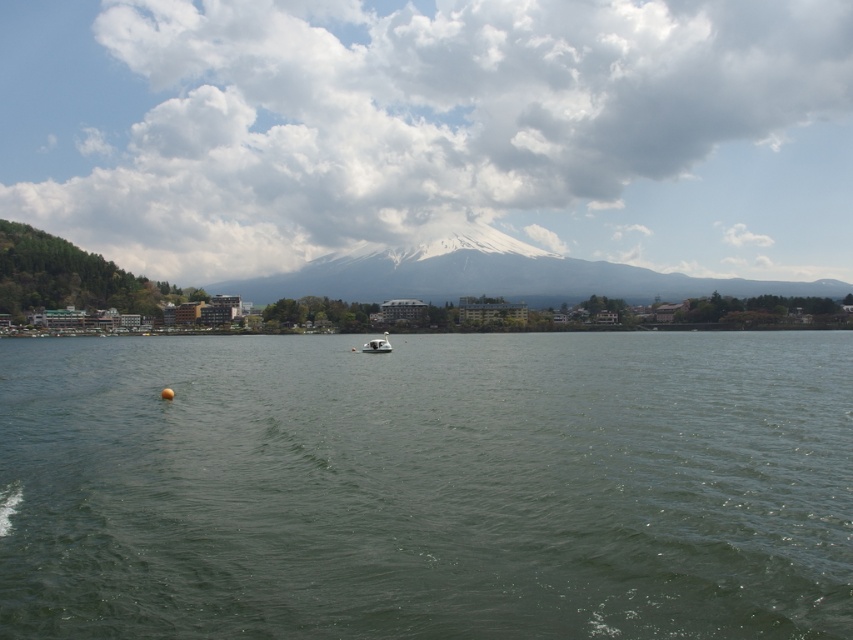
Question: Which object is the closest to the white glossy boat at center?

Choices:
 (A) green water at center
 (B) white snow-covered mountain at center

Answer: (A)

Question: Which point is closer to the camera?

Choices:
 (A) (355, 365)
 (B) (386, 339)

Answer: (A)

Question: Is green water at center bigger than white glossy boat at center?

Choices:
 (A) yes
 (B) no

Answer: (A)

Question: Is white snow-covered mountain at center wider than white glossy boat at center?

Choices:
 (A) no
 (B) yes

Answer: (B)

Question: Is white snow-covered mountain at center above white glossy boat at center?

Choices:
 (A) yes
 (B) no

Answer: (A)

Question: Which of the following is the closest to the observer?

Choices:
 (A) white glossy boat at center
 (B) white snow-covered mountain at center

Answer: (A)